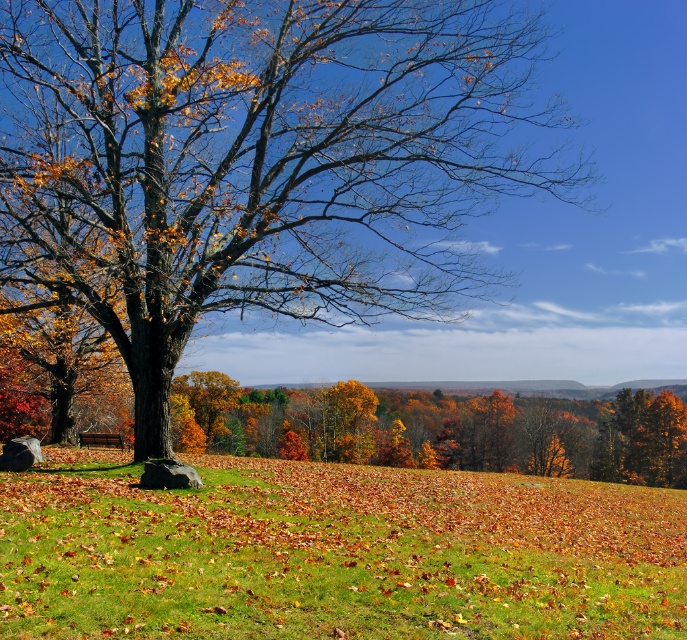
Between matte brown tree at center and green grassy field at center, which one appears on the right side from the viewer's perspective?

Positioned to the right is green grassy field at center.

From the picture: Does matte brown tree at center have a greater height compared to green grassy field at center?

Indeed, matte brown tree at center has a greater height compared to green grassy field at center.

The width and height of the screenshot is (687, 640). I want to click on matte brown tree at center, so click(254, 163).